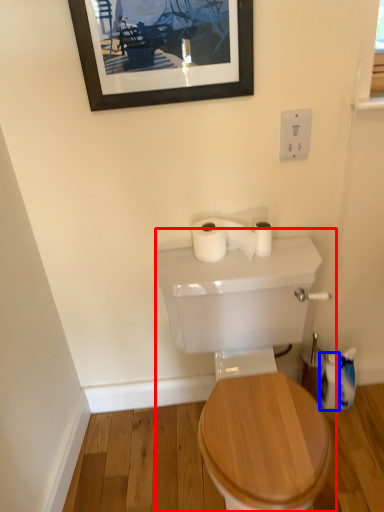
Question: Among these objects, which one is farthest to the camera, sink (highlighted by a red box) or toiletry (highlighted by a blue box)?

Choices:
 (A) sink
 (B) toiletry

Answer: (B)